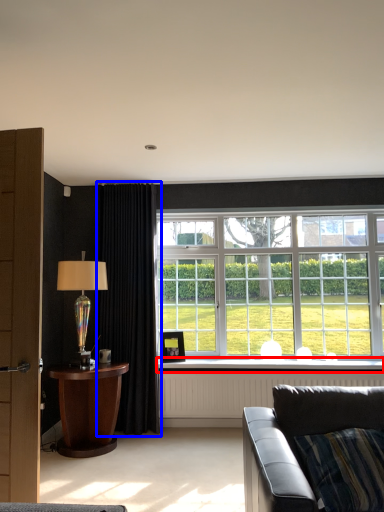
Question: Which object is further to the camera taking this photo, window sill (highlighted by a red box) or curtain (highlighted by a blue box)?

Choices:
 (A) window sill
 (B) curtain

Answer: (A)